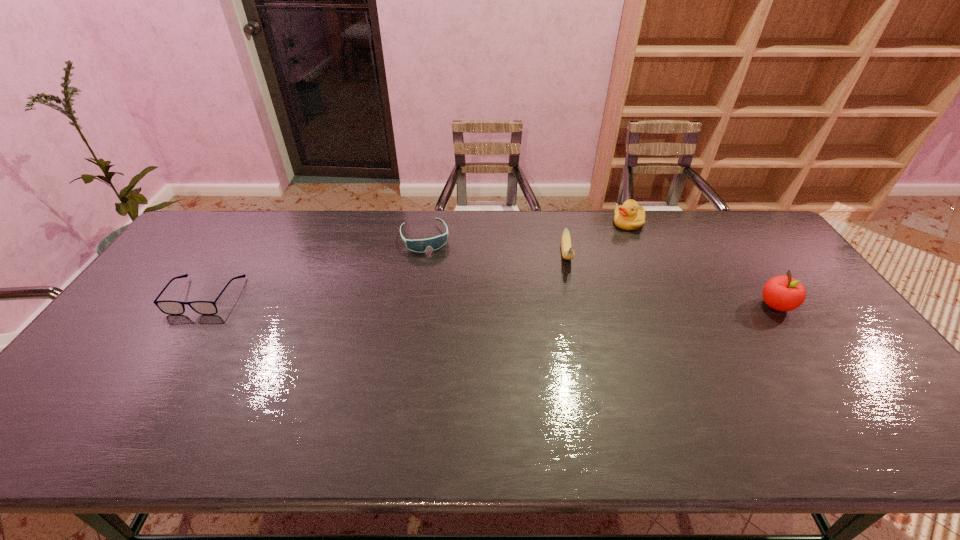
This screenshot has width=960, height=540. In order to click on vacant area located at the stem of the third object from left to right in this screenshot , I will do `click(578, 333)`.

Locate an element on the screen. This screenshot has width=960, height=540. vacant space situated 0.350m on the front-facing side of the second object from left to right is located at coordinates (454, 331).

Locate an element on the screen. This screenshot has width=960, height=540. free point located on the front-facing side of the second object from left to right is located at coordinates (456, 336).

Find the location of a particular element. Image resolution: width=960 pixels, height=540 pixels. vacant space located 0.060m on the front-facing side of the second object from left to right is located at coordinates (433, 265).

Identify the location of vacant area situated on the front-facing side of the duckling. The width and height of the screenshot is (960, 540). (584, 275).

Identify the location of free spot located 0.310m on the front-facing side of the duckling. (581, 278).

Find the location of `vacant space located 0.390m on the front-facing side of the duckling`. vacant space located 0.390m on the front-facing side of the duckling is located at coordinates (568, 293).

You are a GUI agent. You are given a task and a screenshot of the screen. Output one action in this format:
    pyautogui.click(x=<x>, y=<y>)
    Task: Click on the banana at the far edge
    Image resolution: width=960 pixels, height=540 pixels.
    Given the screenshot: What is the action you would take?
    pyautogui.click(x=568, y=253)

Locate an element on the screen. This screenshot has height=540, width=960. goggles present at the far edge is located at coordinates (417, 245).

Where is `duckling that is positioned at the far edge`? This screenshot has height=540, width=960. duckling that is positioned at the far edge is located at coordinates (629, 216).